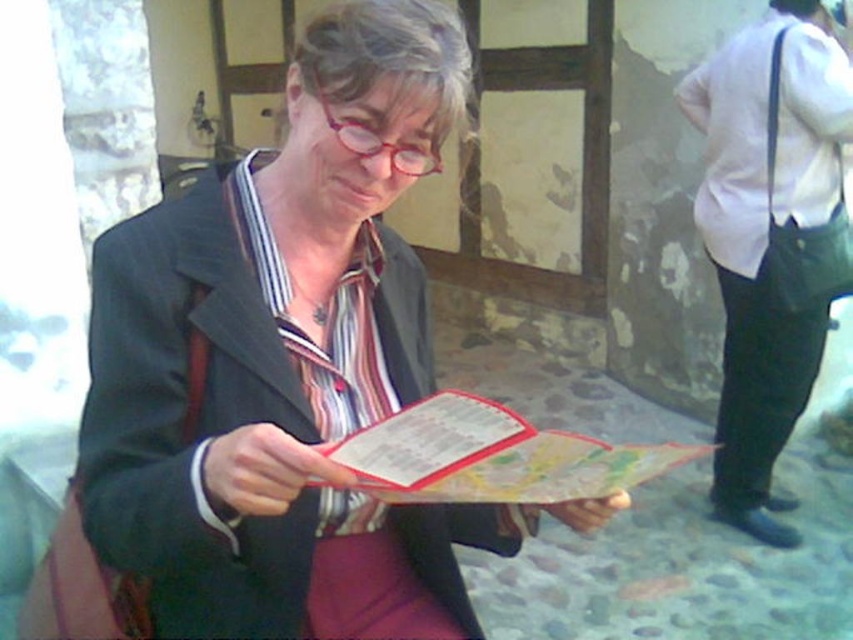
Does matte black jacket at center appear on the right side of white cotton shirt at right?

In fact, matte black jacket at center is to the left of white cotton shirt at right.

Which of these two, matte black jacket at center or white cotton shirt at right, stands taller?

white cotton shirt at right is taller.

Is point (177, 196) more distant than point (699, 125)?

Yes, point (177, 196) is behind point (699, 125).

Image resolution: width=853 pixels, height=640 pixels. I want to click on matte black jacket at center, so [283, 358].

Is white cotton shirt at right positioned before map paper at center?

No, it is not.

Does white cotton shirt at right have a lesser height compared to map paper at center?

No, white cotton shirt at right is not shorter than map paper at center.

Does point (735, 106) lie in front of point (549, 436)?

No.

Image resolution: width=853 pixels, height=640 pixels. Find the location of `white cotton shirt at right`. white cotton shirt at right is located at coordinates (766, 236).

Does point (250, 230) come farther from viewer compared to point (421, 470)?

Yes, it is behind point (421, 470).

Is point (100, 500) in front of point (676, 451)?

Yes, it is in front of point (676, 451).

The image size is (853, 640). Find the location of `matte black jacket at center`. matte black jacket at center is located at coordinates (283, 358).